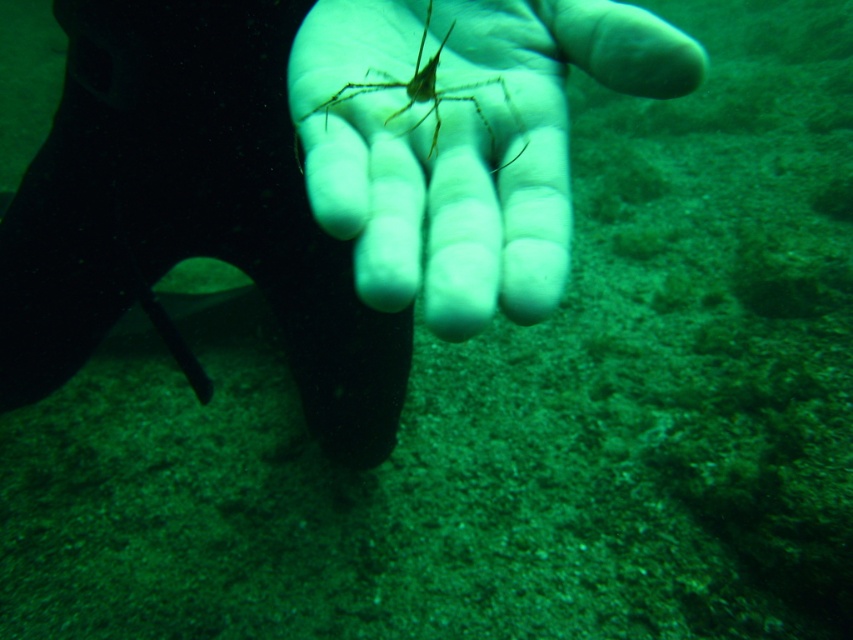
Does translucent yellowish-green hand at center appear on the left side of translucent yellowish spider at center?

Incorrect, translucent yellowish-green hand at center is not on the left side of translucent yellowish spider at center.

Is point (479, 33) more distant than point (321, 108)?

Yes, it is.

The height and width of the screenshot is (640, 853). Find the location of `translucent yellowish-green hand at center`. translucent yellowish-green hand at center is located at coordinates (463, 141).

Who is positioned more to the left, translucent rubber hand at center or translucent yellowish spider at center?

translucent rubber hand at center is more to the left.

Is translucent rubber hand at center closer to camera compared to translucent yellowish spider at center?

No, it is not.

Which is in front, point (131, 140) or point (427, 100)?

Point (427, 100)

The image size is (853, 640). Identify the location of translucent rubber hand at center. (312, 179).

Between point (83, 1) and point (431, 218), which one is positioned behind?

Point (83, 1)

What do you see at coordinates (312, 179) in the screenshot?
I see `translucent rubber hand at center` at bounding box center [312, 179].

Between point (86, 13) and point (521, 323), which one is positioned in front?

Point (521, 323) is more forward.

Locate an element on the screen. This screenshot has width=853, height=640. translucent rubber hand at center is located at coordinates (312, 179).